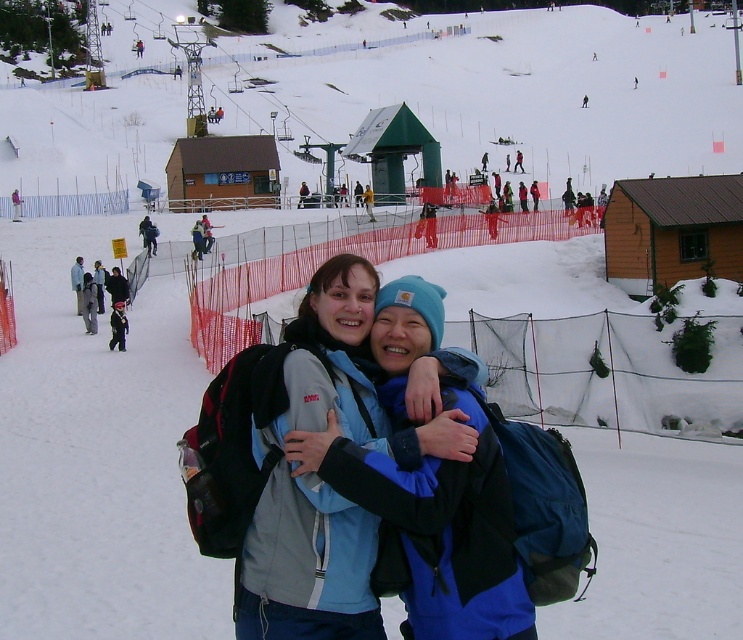
Question: Does blue fabric jacket at center have a lesser width compared to dark blue jacket at center?

Choices:
 (A) yes
 (B) no

Answer: (B)

Question: Which point is closer to the camera?

Choices:
 (A) blue fabric jacket at center
 (B) dark blue jacket at center

Answer: (A)

Question: In this image, where is blue fabric jacket at center located relative to dark blue jacket at center?

Choices:
 (A) right
 (B) left

Answer: (A)

Question: Does blue fabric jacket at center have a smaller size compared to dark blue jacket at center?

Choices:
 (A) no
 (B) yes

Answer: (A)

Question: Which point is closer to the camera taking this photo?

Choices:
 (A) (369, 308)
 (B) (117, 348)

Answer: (A)